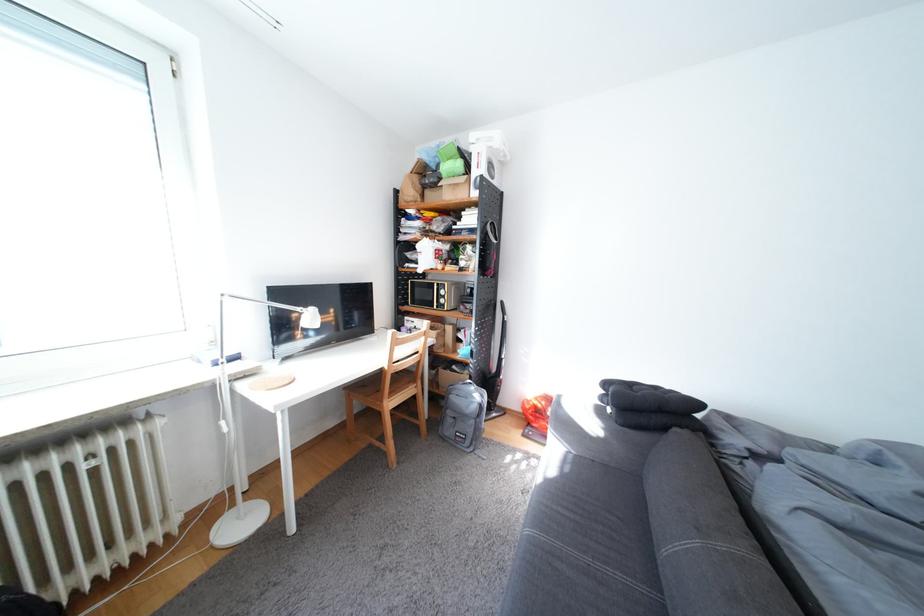
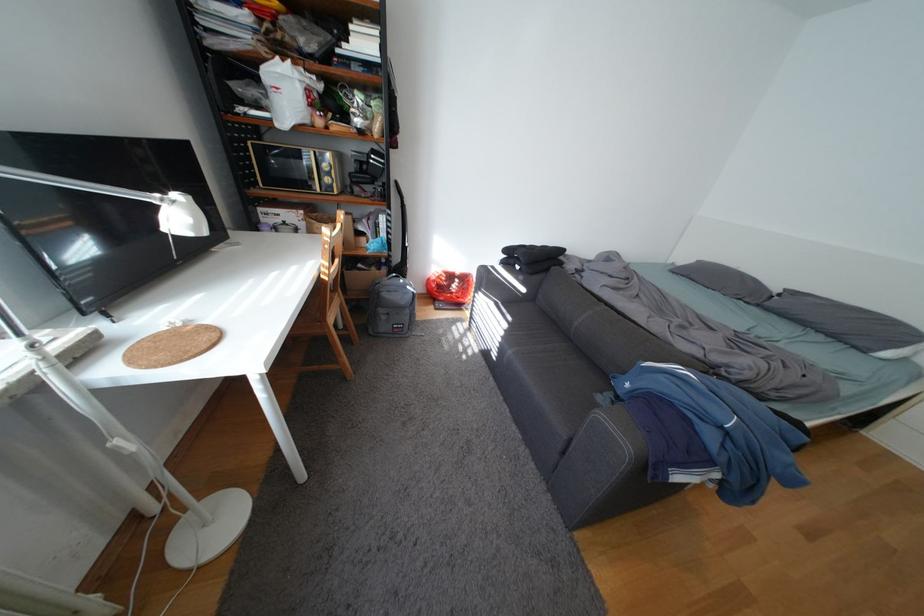
The images are taken continuously from a first-person perspective. In which direction is your viewpoint rotating?

The rotation direction of the camera is right-down.